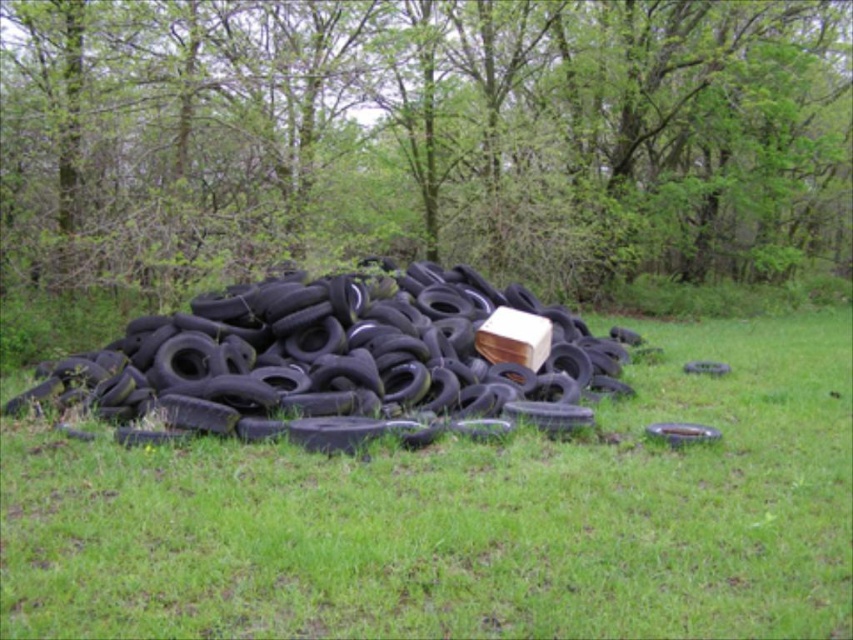
You are standing in the outdoor area and see the green leafy tree at center and the black rubber tire at center. Which object is closer to you?

The green leafy tree at center is in front of the black rubber tire at center, so it is closer to you.